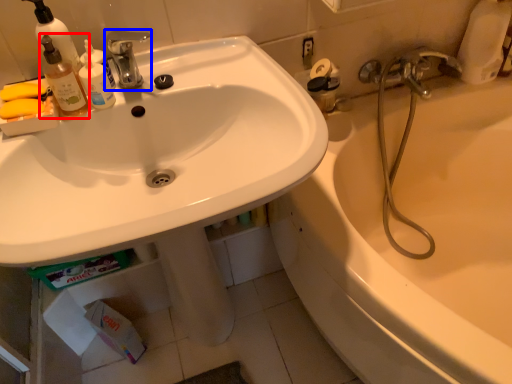
Question: Which point is closer to the camera, bottle (highlighted by a red box) or tap (highlighted by a blue box)?

Choices:
 (A) bottle
 (B) tap

Answer: (A)